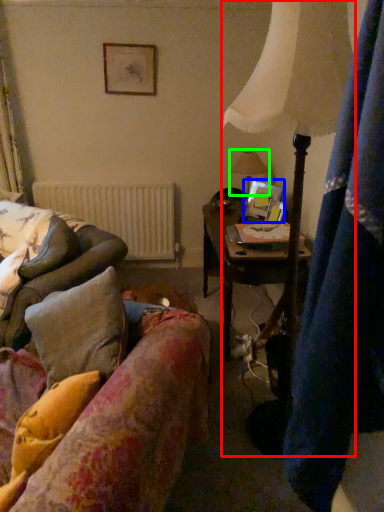
Question: Estimate the real-world distances between objects in this image. Which object is closer to lamp (highlighted by a red box), picture frame (highlighted by a blue box) or table lamp (highlighted by a green box)?

Choices:
 (A) picture frame
 (B) table lamp

Answer: (A)